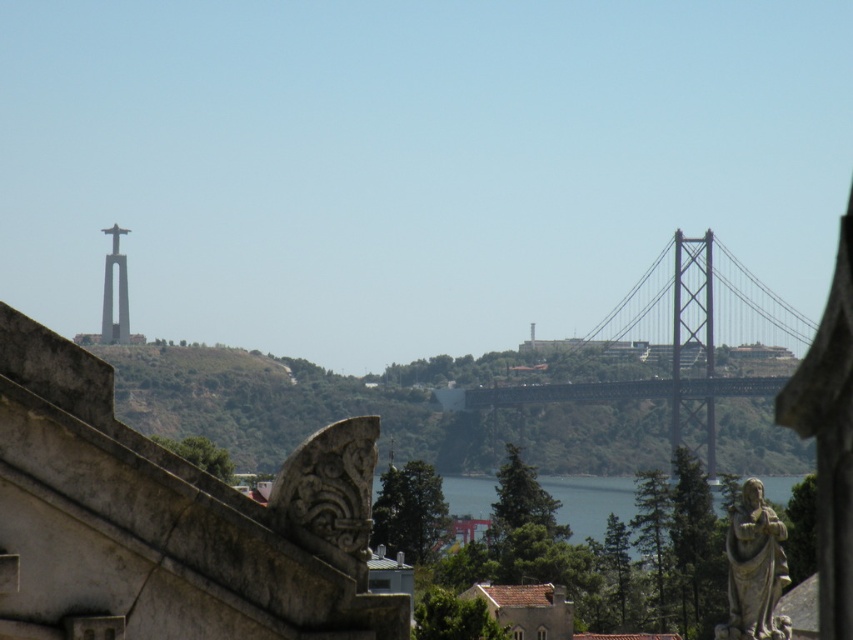
How far apart are metallic bridge at center and stone statue at lower right?

metallic bridge at center and stone statue at lower right are 398.07 meters apart.

Is metallic bridge at center positioned before stone statue at lower right?

No, metallic bridge at center is further to the viewer.

Is point (773, 294) positioned after point (735, 573)?

Yes, it is.

Identify the location of metallic bridge at center. (683, 340).

How distant is metallic bridge at center from blue water at center?

metallic bridge at center and blue water at center are 36.74 meters apart.

Is metallic bridge at center below blue water at center?

Incorrect, metallic bridge at center is not positioned below blue water at center.

Between point (694, 262) and point (581, 509), which one is positioned in front?

Point (581, 509)

This screenshot has width=853, height=640. What are the coordinates of `metallic bridge at center` in the screenshot? It's located at (683, 340).

Identify the location of stone statue at lower right. (753, 568).

Locate an element on the screen. The width and height of the screenshot is (853, 640). stone statue at lower right is located at coordinates (753, 568).